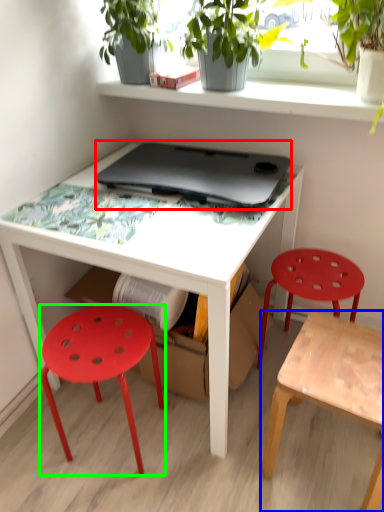
Question: Which object is the farthest from laptop (highlighted by a red box)? Choose among these: stool (highlighted by a blue box) or stool (highlighted by a green box).

Choices:
 (A) stool
 (B) stool

Answer: (A)